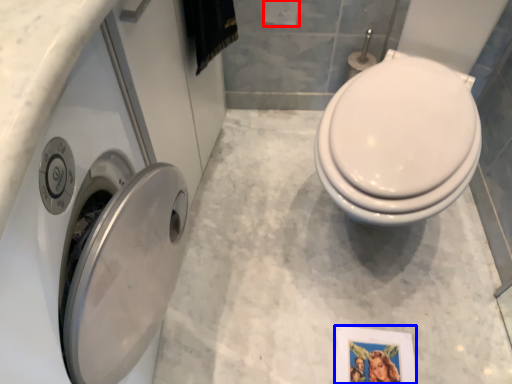
Question: Which of the following is the farthest to the observer, toilet paper (highlighted by a red box) or picture frame (highlighted by a blue box)?

Choices:
 (A) toilet paper
 (B) picture frame

Answer: (B)